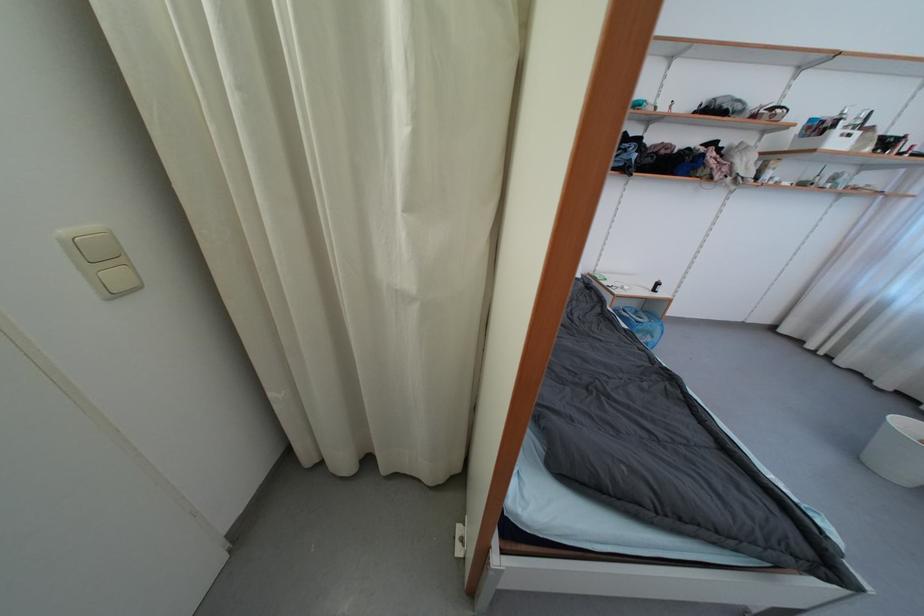
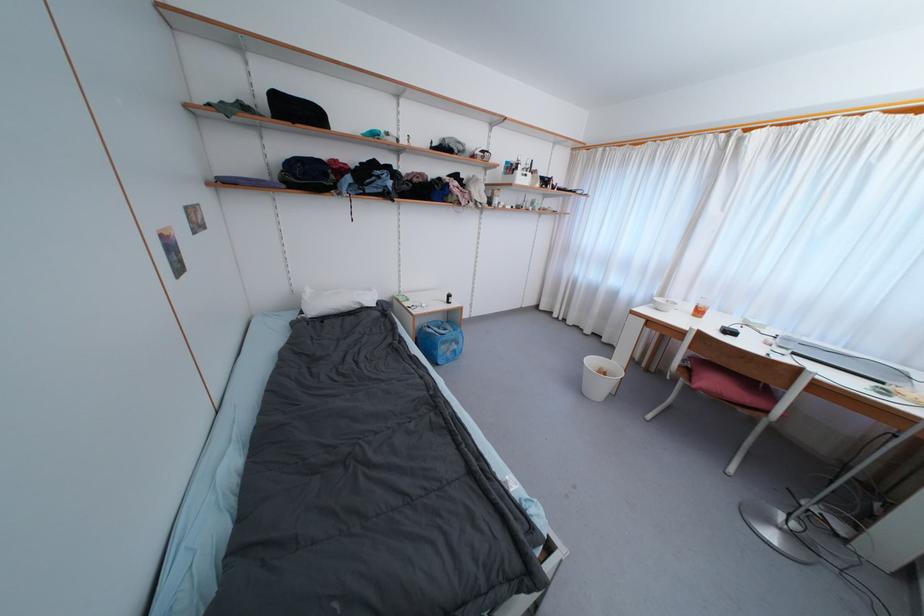
Question: The camera is either moving clockwise (left) or counter-clockwise (right) around the object. The first image is from the beginning of the video and the second image is from the end. Is the camera moving left or right when shooting the video?

Choices:
 (A) Left
 (B) Right

Answer: (A)